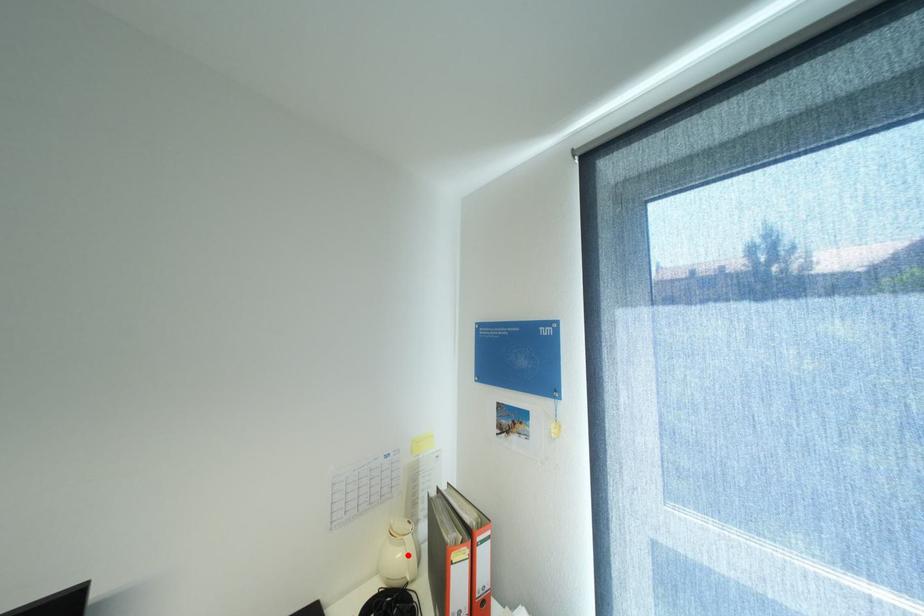
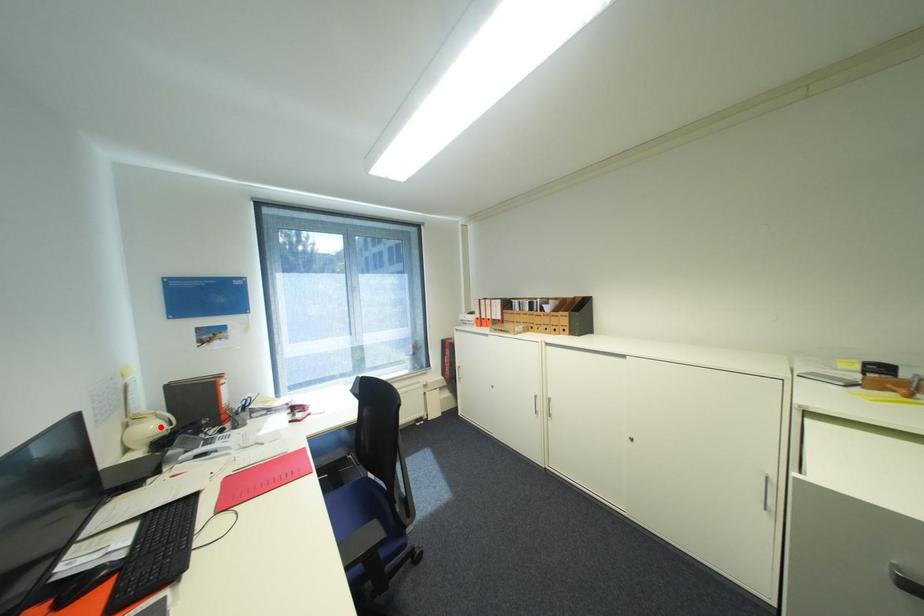
I am providing you with two images of the same scene from different viewpoints. A red point is marked on the first image and another point is marked on the second image. Are the points marked in image1 and image2 representing the same 3D position?

Yes